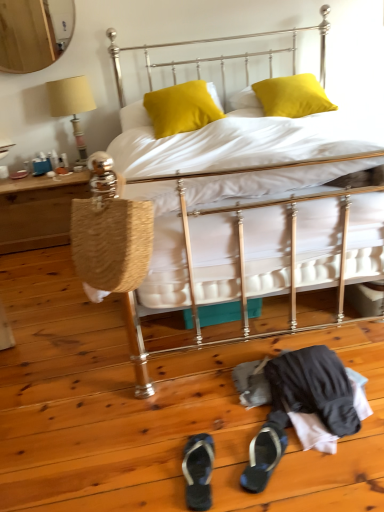
Identify the location of woven straw bag at left. (110, 232).

Image resolution: width=384 pixels, height=512 pixels. What do you see at coordinates (71, 105) in the screenshot? I see `matte yellow fabric lampshade at left` at bounding box center [71, 105].

You are a GUI agent. You are given a task and a screenshot of the screen. Output one action in this format:
    pyautogui.click(x=<x>, y=<y>)
    Task: Click on the blue fabric flip-flop at lower center, which is counted as the 2th footwear, starting from the right
    
    Given the screenshot: What is the action you would take?
    pyautogui.click(x=198, y=471)

I want to click on satin yellow pillow at upper center, marked as the first pillow in a right-to-left arrangement, so [x=292, y=96].

You are a GUI agent. You are given a task and a screenshot of the screen. Output one action in this format:
    pyautogui.click(x=<x>, y=<y>)
    Task: Click on the woven wood table at left
    This screenshot has height=512, width=384.
    Given the screenshot: What is the action you would take?
    pyautogui.click(x=38, y=211)

Is blue fabric flip-flop at lower center, which is counted as the 2th footwear, starting from the right, taller or shorter than gold wooden mirror at upper left?

Clearly, blue fabric flip-flop at lower center, which is counted as the 2th footwear, starting from the right, is shorter compared to gold wooden mirror at upper left.

From a real-world perspective, between blue fabric flip-flop at lower center, which ranks as the first footwear in left-to-right order, and gold wooden mirror at upper left, who is vertically lower?

In real-world perspective, blue fabric flip-flop at lower center, which ranks as the first footwear in left-to-right order, is lower.

Who is more distant, satin yellow pillow at upper center, marked as the first pillow in a right-to-left arrangement, or woven wood table at left?

Positioned behind is woven wood table at left.

Based on the photo, does satin yellow pillow at upper center, which appears as the 2th pillow when viewed from the left, have a smaller size compared to woven wood table at left?

Indeed, satin yellow pillow at upper center, which appears as the 2th pillow when viewed from the left, has a smaller size compared to woven wood table at left.

Considering the relative sizes of woven straw bag at left and blue fabric flip-flop at lower center, which is counted as the 2th footwear, starting from the right, in the image provided, is woven straw bag at left shorter than blue fabric flip-flop at lower center, which is counted as the 2th footwear, starting from the right,?

No, woven straw bag at left is not shorter than blue fabric flip-flop at lower center, which is counted as the 2th footwear, starting from the right.

Considering the relative sizes of woven straw bag at left and blue fabric flip-flop at lower center, which is counted as the 2th footwear, starting from the right, in the image provided, is woven straw bag at left smaller than blue fabric flip-flop at lower center, which is counted as the 2th footwear, starting from the right,?

Actually, woven straw bag at left might be larger than blue fabric flip-flop at lower center, which is counted as the 2th footwear, starting from the right.

Considering the sizes of woven straw bag at left and blue fabric flip-flop at lower center, which is counted as the 2th footwear, starting from the right, in the image, is woven straw bag at left wider or thinner than blue fabric flip-flop at lower center, which is counted as the 2th footwear, starting from the right,?

woven straw bag at left is wider than blue fabric flip-flop at lower center, which is counted as the 2th footwear, starting from the right.

Which object is positioned more to the right, woven straw bag at left or blue fabric flip-flop at lower center, which ranks as the first footwear in left-to-right order?

blue fabric flip-flop at lower center, which ranks as the first footwear in left-to-right order, is more to the right.

Is woven wood table at left looking in the opposite direction of gold wooden mirror at upper left?

No, gold wooden mirror at upper left is not at the back of woven wood table at left.

Can you confirm if woven wood table at left is shorter than gold wooden mirror at upper left?

Yes, woven wood table at left is shorter than gold wooden mirror at upper left.

Which is in front, woven wood table at left or gold wooden mirror at upper left?

Positioned in front is gold wooden mirror at upper left.

What's the angular difference between woven wood table at left and gold wooden mirror at upper left's facing directions?

The angular difference between woven wood table at left and gold wooden mirror at upper left is 0.584 degrees.

Is satin yellow pillow at upper center, marked as the first pillow in a right-to-left arrangement, completely or partially outside of metallic bed at center?

No.

From a real-world perspective, between satin yellow pillow at upper center, marked as the first pillow in a right-to-left arrangement, and metallic bed at center, who is vertically higher?

In real-world perspective, satin yellow pillow at upper center, marked as the first pillow in a right-to-left arrangement, is above.

Which is more distant, (304, 73) or (312, 116)?

The point (304, 73) is behind.

Is satin yellow pillow at upper center, which appears as the 2th pillow when viewed from the left, positioned far away from metallic bed at center?

satin yellow pillow at upper center, which appears as the 2th pillow when viewed from the left, is actually quite close to metallic bed at center.

Is woven straw bag at left bigger than dark gray fabric sandal at lower center, positioned as the first footwear in right-to-left order?

Indeed, woven straw bag at left has a larger size compared to dark gray fabric sandal at lower center, positioned as the first footwear in right-to-left order.

Is woven straw bag at left thinner than dark gray fabric sandal at lower center, the 2th footwear positioned from the left?

Yes, woven straw bag at left is thinner than dark gray fabric sandal at lower center, the 2th footwear positioned from the left.

From the image's perspective, is woven straw bag at left located beneath dark gray fabric sandal at lower center, positioned as the first footwear in right-to-left order?

No.

Is dark gray fabric sandal at lower center, the 2th footwear positioned from the left, a part of woven straw bag at left?

No, dark gray fabric sandal at lower center, the 2th footwear positioned from the left, is not inside woven straw bag at left.

From the image's perspective, is matte yellow fabric lampshade at left beneath satin yellow pillow at center, positioned as the first pillow in left-to-right order?

Correct, matte yellow fabric lampshade at left appears lower than satin yellow pillow at center, positioned as the first pillow in left-to-right order, in the image.

Considering the sizes of matte yellow fabric lampshade at left and satin yellow pillow at center, which ranks as the second pillow in right-to-left order, in the image, is matte yellow fabric lampshade at left bigger or smaller than satin yellow pillow at center, which ranks as the second pillow in right-to-left order,?

matte yellow fabric lampshade at left is bigger than satin yellow pillow at center, which ranks as the second pillow in right-to-left order.

From a real-world perspective, which is physically below, matte yellow fabric lampshade at left or satin yellow pillow at center, which ranks as the second pillow in right-to-left order?

From a 3D spatial view, matte yellow fabric lampshade at left is below.

Between point (84, 103) and point (148, 106), which one is positioned in front?

The point (148, 106) is closer to the camera.

Find the location of a particular element. the 1st footwear below the gold wooden mirror at upper left (from a real-world perspective) is located at coordinates (198, 471).

Locate an element on the screen. The height and width of the screenshot is (512, 384). the 1st pillow directly above the woven wood table at left (from a real-world perspective) is located at coordinates (292, 96).

Looking at the image, which one is located further to metallic bed at center, dark gray fabric sandal at lower center, positioned as the first footwear in right-to-left order, or matte yellow fabric lampshade at left?

matte yellow fabric lampshade at left is positioned further to the anchor metallic bed at center.

Considering their positions, is gold wooden mirror at upper left positioned further to satin yellow pillow at upper center, which appears as the 2th pillow when viewed from the left, than satin yellow pillow at center, which ranks as the second pillow in right-to-left order?

gold wooden mirror at upper left lies further to satin yellow pillow at upper center, which appears as the 2th pillow when viewed from the left, than the other object.

From the image, which object appears to be nearer to matte yellow fabric lampshade at left, satin yellow pillow at upper center, which appears as the 2th pillow when viewed from the left, or dark gray fabric sandal at lower center, the 2th footwear positioned from the left?

satin yellow pillow at upper center, which appears as the 2th pillow when viewed from the left.

Estimate the real-world distances between objects in this image. Which object is further from gold wooden mirror at upper left, woven wood table at left or matte yellow fabric lampshade at left?

woven wood table at left lies further to gold wooden mirror at upper left than the other object.

Based on their spatial positions, is dark gray fabric sandal at lower center, positioned as the first footwear in right-to-left order, or woven straw bag at left further from matte yellow fabric lampshade at left?

dark gray fabric sandal at lower center, positioned as the first footwear in right-to-left order.

Looking at the image, which one is located further to blue fabric flip-flop at lower center, which ranks as the first footwear in left-to-right order, matte yellow fabric lampshade at left or satin yellow pillow at upper center, which appears as the 2th pillow when viewed from the left?

matte yellow fabric lampshade at left lies further to blue fabric flip-flop at lower center, which ranks as the first footwear in left-to-right order, than the other object.

Which object lies nearer to the anchor point matte yellow fabric lampshade at left, blue fabric flip-flop at lower center, which ranks as the first footwear in left-to-right order, or metallic bed at center?

The object closer to matte yellow fabric lampshade at left is metallic bed at center.

Based on their spatial positions, is gold wooden mirror at upper left or satin yellow pillow at upper center, marked as the first pillow in a right-to-left arrangement, closer to metallic bed at center?

satin yellow pillow at upper center, marked as the first pillow in a right-to-left arrangement, is positioned closer to the anchor metallic bed at center.

At what (x,y) coordinates should I click in order to perform the action: click on mirror positioned between metallic bed at center and matte yellow fabric lampshade at left from near to far. Please return your answer as a coordinate pair (x, y). The image size is (384, 512). Looking at the image, I should click on (34, 33).

I want to click on table lamp situated between gold wooden mirror at upper left and satin yellow pillow at upper center, marked as the first pillow in a right-to-left arrangement, from left to right, so click(71, 105).

Identify the location of handbag between satin yellow pillow at center, positioned as the first pillow in left-to-right order, and blue fabric flip-flop at lower center, which ranks as the first footwear in left-to-right order, from top to bottom. (110, 232).

I want to click on bed that lies between satin yellow pillow at upper center, marked as the first pillow in a right-to-left arrangement, and dark gray fabric sandal at lower center, positioned as the first footwear in right-to-left order, from top to bottom, so click(x=262, y=237).